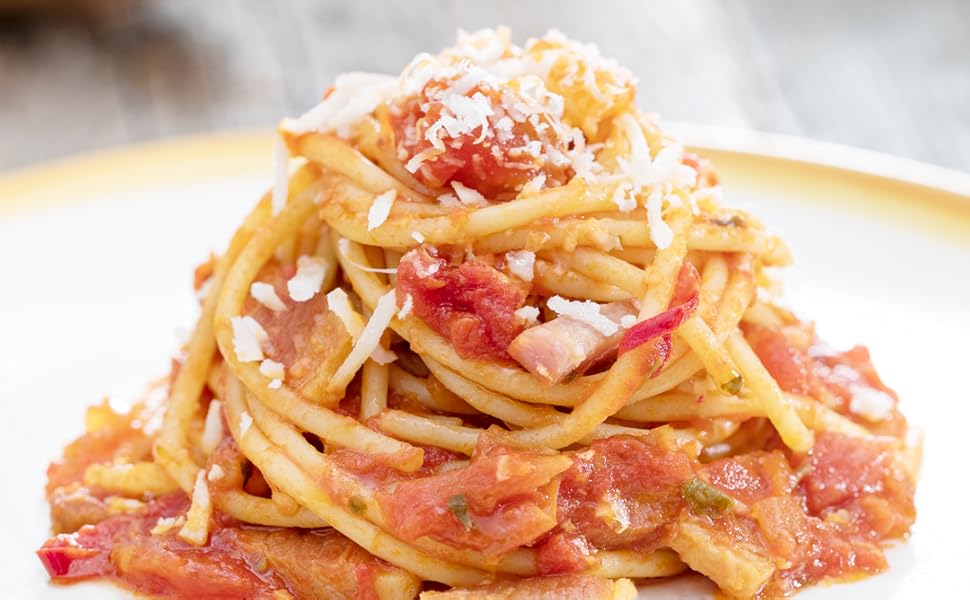
Find the location of a particular element. Image resolution: width=970 pixels, height=600 pixels. white plate is located at coordinates (861, 268).